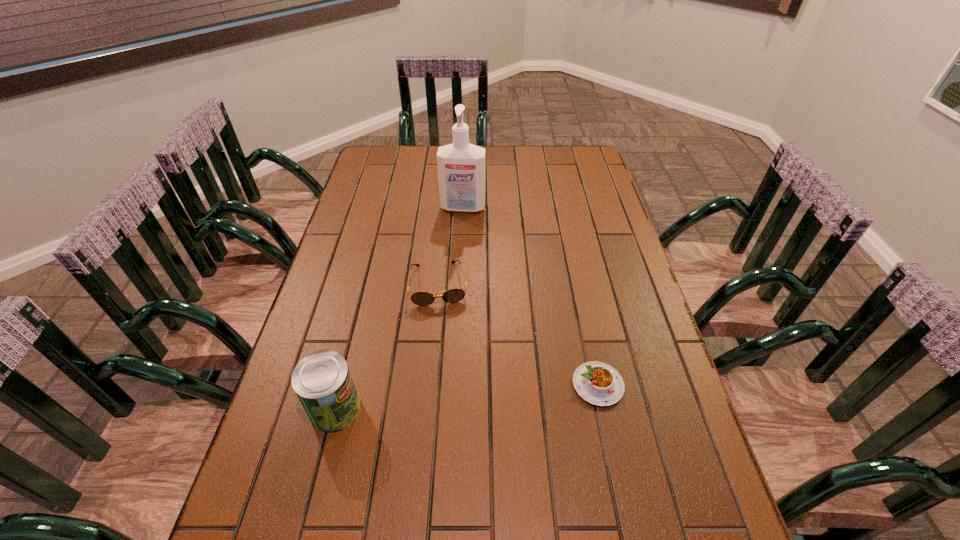
Locate an element on the screen. The image size is (960, 540). vacant position located on the front label of the farthest object is located at coordinates (455, 255).

You are a GUI agent. You are given a task and a screenshot of the screen. Output one action in this format:
    pyautogui.click(x=<x>, y=<y>)
    Task: Click on the free space located 0.350m on the front label of the farthest object
    
    Given the screenshot: What is the action you would take?
    pyautogui.click(x=449, y=290)

Find the location of `vacant area located 0.280m on the front label of the farthest object`. vacant area located 0.280m on the front label of the farthest object is located at coordinates (452, 273).

This screenshot has width=960, height=540. I want to click on vacant space located 0.140m on the lenses of the sunglasses, so click(x=444, y=348).

Where is `vacant space located 0.070m on the lenses of the sunglasses`? vacant space located 0.070m on the lenses of the sunglasses is located at coordinates (443, 326).

Where is `free point located 0.210m on the lenses of the sunglasses`? free point located 0.210m on the lenses of the sunglasses is located at coordinates (x=446, y=371).

The width and height of the screenshot is (960, 540). In order to click on object at the left edge in this screenshot , I will do 322,381.

Where is `object that is at the right edge`? This screenshot has height=540, width=960. object that is at the right edge is located at coordinates (597, 383).

Identify the location of free spot at the far edge of the desktop. (x=530, y=159).

This screenshot has height=540, width=960. In order to click on vacant region at the left edge of the desktop in this screenshot , I will do pyautogui.click(x=376, y=190).